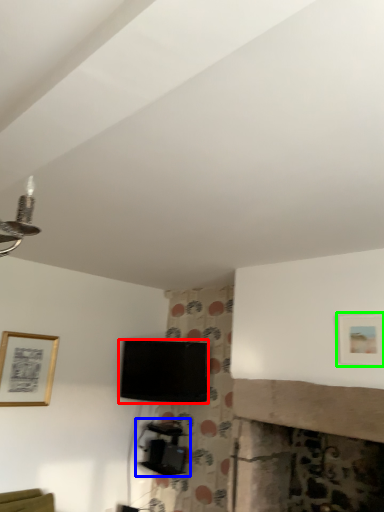
Question: Which object is the farthest from television (highlighted by a red box)? Choose among these: furniture (highlighted by a blue box) or picture frame (highlighted by a green box).

Choices:
 (A) furniture
 (B) picture frame

Answer: (B)